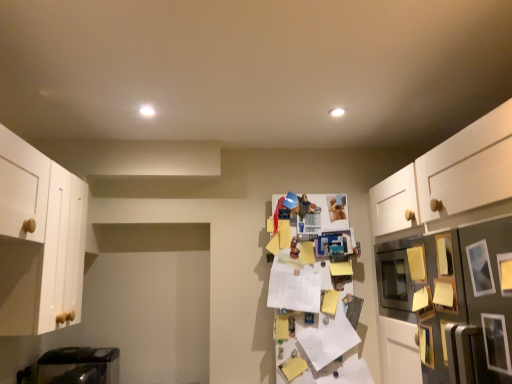
Question: From a real-world perspective, is wooden picture frame at right, the second picture frame when ordered from back to front, on top of metallic silver refrigerator at right, the 2th shelf positioned from the back?

Choices:
 (A) yes
 (B) no

Answer: (A)

Question: Would you say wooden picture frame at right, the second picture frame when ordered from back to front, contains metallic silver refrigerator at right, the first shelf from the right?

Choices:
 (A) yes
 (B) no

Answer: (B)

Question: Is wooden picture frame at right, acting as the 4th picture frame starting from the front, wider than metallic silver refrigerator at right, the first shelf from the right?

Choices:
 (A) yes
 (B) no

Answer: (B)

Question: From the image's perspective, would you say wooden picture frame at right, acting as the 4th picture frame starting from the front, is positioned over metallic silver refrigerator at right, the first shelf from the right?

Choices:
 (A) yes
 (B) no

Answer: (A)

Question: From the image's perspective, is wooden picture frame at right, the second picture frame when ordered from back to front, below metallic silver refrigerator at right, arranged as the second shelf when viewed from the left?

Choices:
 (A) yes
 (B) no

Answer: (B)

Question: Is white matte cabinet at left situated inside wooden picture frame at right, acting as the 4th picture frame starting from the front, or outside?

Choices:
 (A) outside
 (B) inside

Answer: (A)

Question: Is point (3, 286) closer or farther from the camera than point (444, 236)?

Choices:
 (A) closer
 (B) farther

Answer: (B)

Question: Based on their positions, is white matte cabinet at left located to the left or right of wooden picture frame at right, the second picture frame when ordered from back to front?

Choices:
 (A) left
 (B) right

Answer: (A)

Question: Relative to wooden picture frame at right, the second picture frame when ordered from back to front, is white matte cabinet at left in front or behind?

Choices:
 (A) behind
 (B) front

Answer: (B)

Question: Which is correct: metallic silver picture frame at right, which appears as the second picture frame when viewed from the front, is inside yellow paper at center, marked as the second shelf in a right-to-left arrangement, or outside of it?

Choices:
 (A) inside
 (B) outside

Answer: (B)

Question: From a real-world perspective, is metallic silver picture frame at right, the 4th picture frame positioned from the back, positioned above or below yellow paper at center, marked as the second shelf in a right-to-left arrangement?

Choices:
 (A) above
 (B) below

Answer: (B)

Question: Based on their sizes in the image, would you say metallic silver picture frame at right, the 4th picture frame positioned from the back, is bigger or smaller than yellow paper at center, the first shelf in the left-to-right sequence?

Choices:
 (A) small
 (B) big

Answer: (A)

Question: Would you say metallic silver picture frame at right, which appears as the second picture frame when viewed from the front, is to the left or to the right of yellow paper at center, marked as the second shelf in a right-to-left arrangement, in the picture?

Choices:
 (A) left
 (B) right

Answer: (B)

Question: Is point (431, 352) positioned closer to the camera than point (493, 339)?

Choices:
 (A) farther
 (B) closer

Answer: (A)

Question: Is wooden picture frame at lower right, which is the fifth picture frame from front to back, wider or thinner than metallic silver picture frame at right, the 4th picture frame positioned from the back?

Choices:
 (A) wide
 (B) thin

Answer: (A)